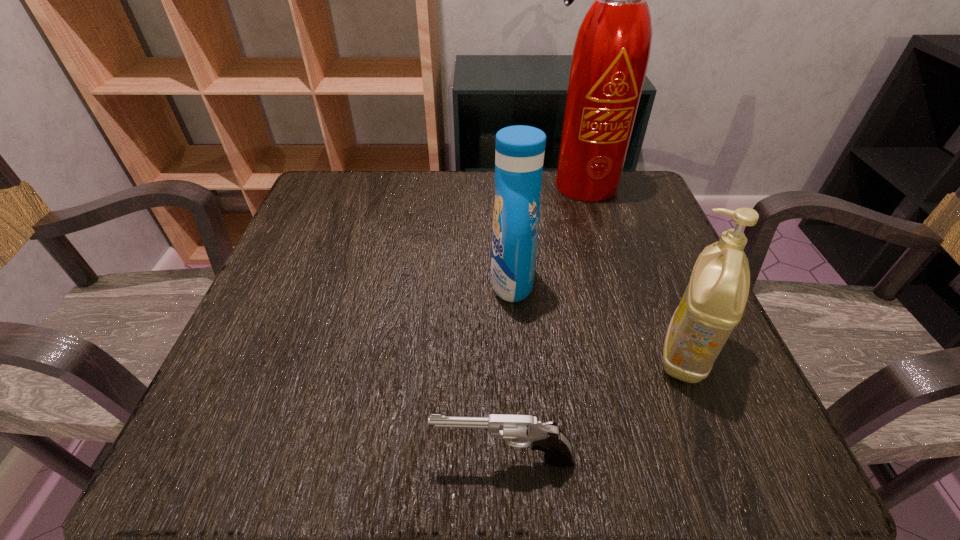
Locate an element on the screen. The image size is (960, 540). unoccupied area between the left detergent and the shortest object is located at coordinates (508, 370).

The image size is (960, 540). I want to click on free area in between the tallest object and the right detergent, so click(x=633, y=269).

Identify the location of free space between the shortest object and the farthest object. (542, 322).

Locate an element on the screen. This screenshot has width=960, height=540. free space that is in between the gun and the fire extinguisher is located at coordinates (542, 322).

This screenshot has width=960, height=540. What are the coordinates of `blank region between the second tallest object and the tallest object` in the screenshot? It's located at (546, 233).

This screenshot has height=540, width=960. In order to click on vacant space that's between the third shortest object and the shorter detergent in this screenshot , I will do `click(598, 317)`.

Identify the location of free point between the taller detergent and the nearest object. coord(508,370).

Choose which object is the third nearest neighbor to the farthest object. Please provide its 2D coordinates. Your answer should be formatted as a tuple, i.e. [(x, y)], where the tuple contains the x and y coordinates of a point satisfying the conditions above.

[(547, 437)]

Select which object appears as the closest to the shorter detergent. Please provide its 2D coordinates. Your answer should be formatted as a tuple, i.e. [(x, y)], where the tuple contains the x and y coordinates of a point satisfying the conditions above.

[(547, 437)]

Identify the location of free space that satisfies the following two spatial constraints: 1. on the front-facing side of the third nearest object; 2. on the right side of the shorter detergent. (516, 353).